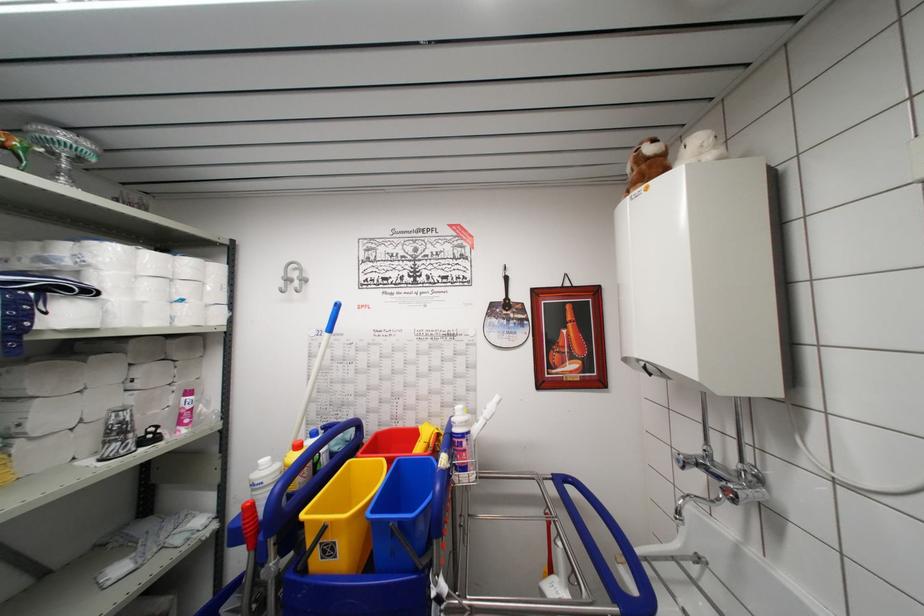
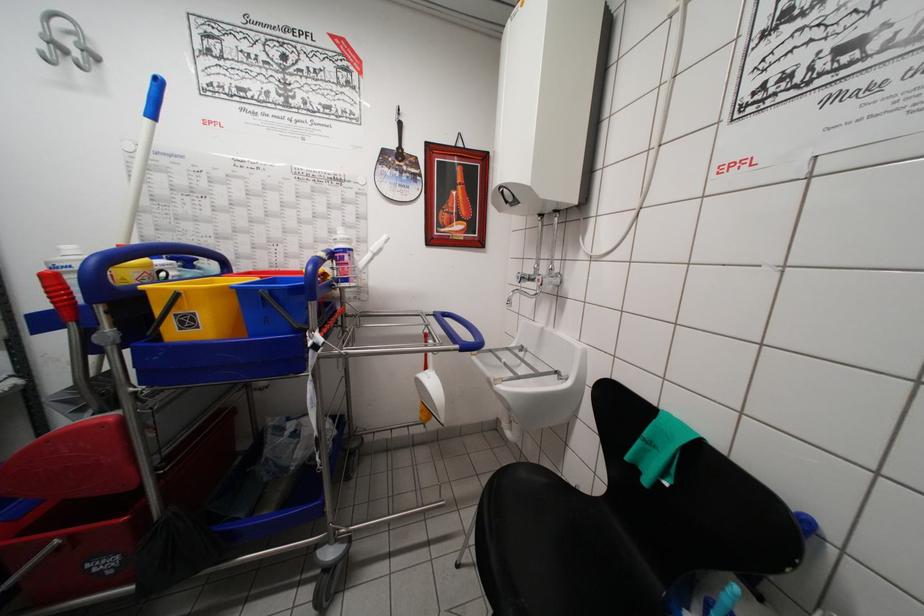
Where in the second image is the point corresponding to point (307, 280) from the first image?

(92, 51)